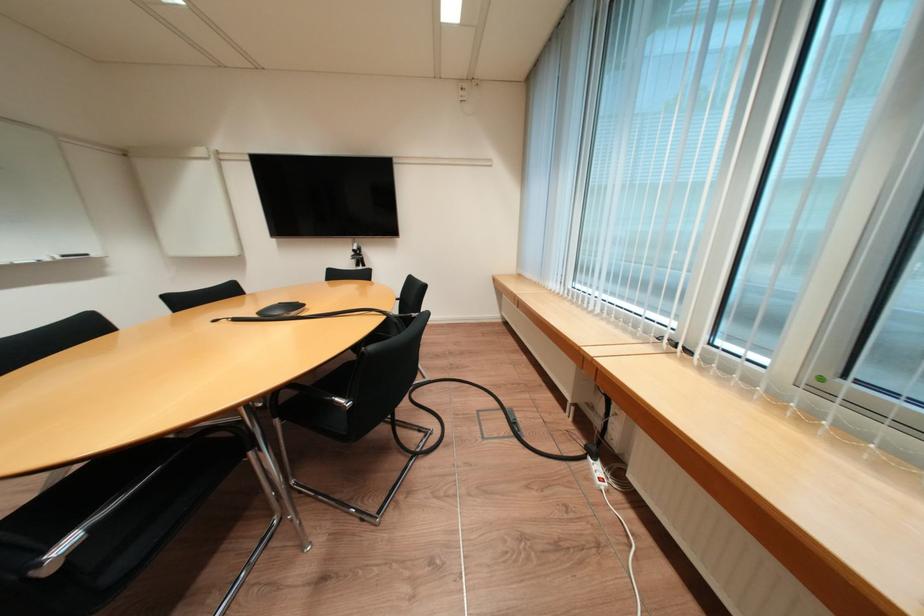
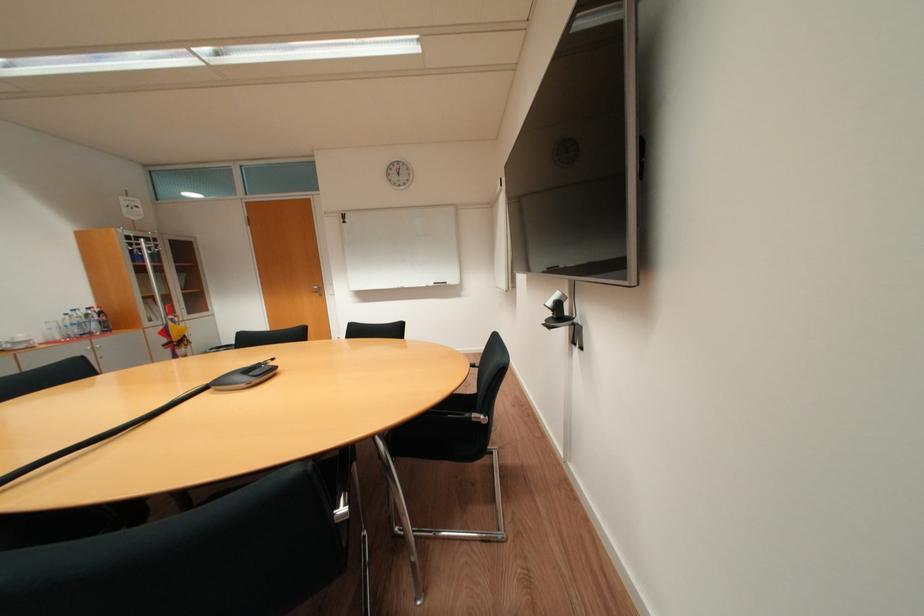
Question: I am providing you with two images of the same scene from different viewpoints. Which of the following objects are not visible in image2?

Choices:
 (A) black wall camera
 (B) whiteboard eraser
 (C) metal chair armrest
 (D) none of these

Answer: (D)